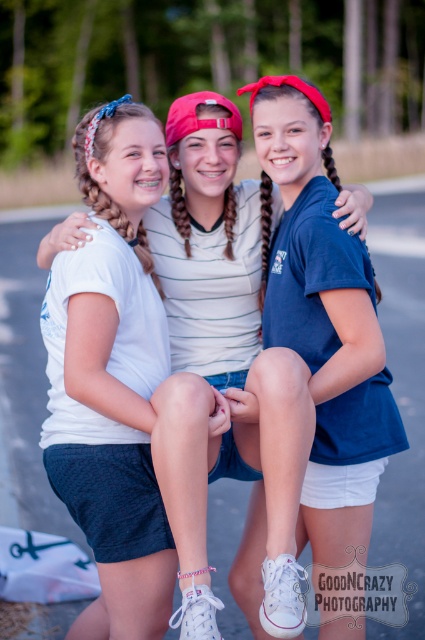
Between blue cotton shirt at center and dark brown hair at center, which one is positioned higher?

Positioned higher is dark brown hair at center.

Which is more to the left, blue cotton shirt at center or dark brown hair at center?

Positioned to the left is dark brown hair at center.

Locate an element on the screen. blue cotton shirt at center is located at coordinates (322, 282).

Find the location of a particular element. blue cotton shirt at center is located at coordinates (322, 282).

This screenshot has height=640, width=425. What do you see at coordinates (221, 339) in the screenshot? I see `white matte t-shirt at center` at bounding box center [221, 339].

Between white matte t-shirt at center and blue cotton shirt at center, which one appears on the right side from the viewer's perspective?

blue cotton shirt at center is more to the right.

Between point (274, 196) and point (261, 97), which one is positioned in front?

Positioned in front is point (261, 97).

Locate an element on the screen. The image size is (425, 640). white matte t-shirt at center is located at coordinates 221,339.

How much distance is there between white matte t-shirt at center and dark brown hair at center?

They are 26.21 inches apart.

Is white matte t-shirt at center shorter than dark brown hair at center?

No.

The height and width of the screenshot is (640, 425). Identify the location of white matte t-shirt at center. (221, 339).

Image resolution: width=425 pixels, height=640 pixels. Find the location of `white matte t-shirt at center`. white matte t-shirt at center is located at coordinates (221, 339).